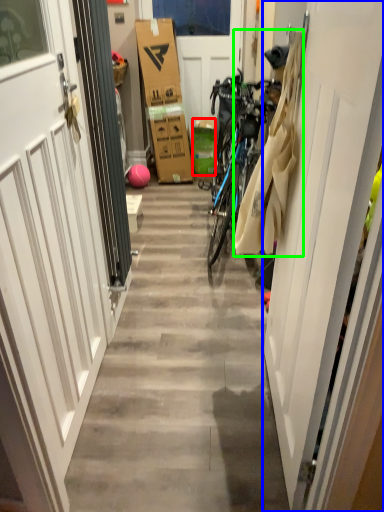
Question: Which object is the closest to the box (highlighted by a red box)? Choose among these: door (highlighted by a blue box) or laundry (highlighted by a green box).

Choices:
 (A) door
 (B) laundry

Answer: (B)